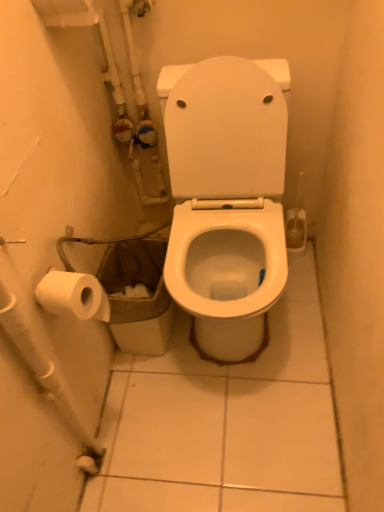
Question: Can you confirm if brown paper bag at lower left is positioned to the left of white plastic water pipe at lower left?

Choices:
 (A) no
 (B) yes

Answer: (A)

Question: Is white plastic water pipe at lower left located within brown paper bag at lower left?

Choices:
 (A) no
 (B) yes

Answer: (A)

Question: Is brown paper bag at lower left oriented away from white plastic water pipe at lower left?

Choices:
 (A) no
 (B) yes

Answer: (A)

Question: Can you confirm if brown paper bag at lower left is bigger than white plastic water pipe at lower left?

Choices:
 (A) yes
 (B) no

Answer: (A)

Question: Considering the relative sizes of brown paper bag at lower left and white plastic water pipe at lower left in the image provided, is brown paper bag at lower left smaller than white plastic water pipe at lower left?

Choices:
 (A) no
 (B) yes

Answer: (A)

Question: In the image, is white glossy toilet at center positioned in front of or behind brown paper bag at lower left?

Choices:
 (A) front
 (B) behind

Answer: (A)

Question: Would you say white glossy toilet at center is inside or outside brown paper bag at lower left?

Choices:
 (A) inside
 (B) outside

Answer: (B)

Question: Considering the positions of white glossy toilet at center and brown paper bag at lower left in the image, is white glossy toilet at center taller or shorter than brown paper bag at lower left?

Choices:
 (A) tall
 (B) short

Answer: (A)

Question: From a real-world perspective, is white glossy toilet at center physically located above or below brown paper bag at lower left?

Choices:
 (A) below
 (B) above

Answer: (B)

Question: Considering their positions, is brown paper bag at lower left located in front of or behind white glossy toilet at center?

Choices:
 (A) behind
 (B) front

Answer: (A)

Question: Considering the relative positions of brown paper bag at lower left and white glossy toilet at center in the image provided, is brown paper bag at lower left to the left or to the right of white glossy toilet at center?

Choices:
 (A) right
 (B) left

Answer: (B)

Question: Is brown paper bag at lower left inside or outside of white glossy toilet at center?

Choices:
 (A) inside
 (B) outside

Answer: (B)

Question: From a real-world perspective, is brown paper bag at lower left positioned above or below white glossy toilet at center?

Choices:
 (A) above
 (B) below

Answer: (B)

Question: From the image's perspective, is white plastic water pipe at lower left above or below white glossy toilet at center?

Choices:
 (A) below
 (B) above

Answer: (A)

Question: Is white plastic water pipe at lower left situated inside white glossy toilet at center or outside?

Choices:
 (A) inside
 (B) outside

Answer: (B)